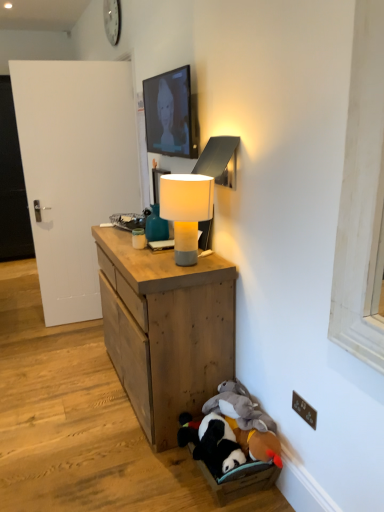
Question: Is the position of white matte door at left, which ranks as the 2th door in front-to-back order, more distant than that of white matte lamp at center?

Choices:
 (A) no
 (B) yes

Answer: (B)

Question: Considering the relative sizes of white matte door at left, which ranks as the 2th door in front-to-back order, and white matte lamp at center in the image provided, is white matte door at left, which ranks as the 2th door in front-to-back order, thinner than white matte lamp at center?

Choices:
 (A) yes
 (B) no

Answer: (B)

Question: Does white matte door at left, which ranks as the 2th door in front-to-back order, have a lesser height compared to white matte lamp at center?

Choices:
 (A) yes
 (B) no

Answer: (B)

Question: Is white matte door at left, positioned as the 1th door in left-to-right order, at the right side of white matte lamp at center?

Choices:
 (A) yes
 (B) no

Answer: (B)

Question: From a real-world perspective, is white matte door at left, which ranks as the 2th door in front-to-back order, under white matte lamp at center?

Choices:
 (A) yes
 (B) no

Answer: (A)

Question: Considering the relative sizes of white matte door at left, acting as the 2th door starting from the right, and white matte lamp at center in the image provided, is white matte door at left, acting as the 2th door starting from the right, bigger than white matte lamp at center?

Choices:
 (A) no
 (B) yes

Answer: (B)

Question: Does soft plush toys at lower right have a lesser width compared to white matte door at left, the second door in the left-to-right sequence?

Choices:
 (A) yes
 (B) no

Answer: (B)

Question: Considering the relative positions of soft plush toys at lower right and white matte door at left, the 1th door when ordered from front to back, in the image provided, is soft plush toys at lower right to the left of white matte door at left, the 1th door when ordered from front to back, from the viewer's perspective?

Choices:
 (A) yes
 (B) no

Answer: (B)

Question: Is soft plush toys at lower right aimed at white matte door at left, the second door in the back-to-front sequence?

Choices:
 (A) yes
 (B) no

Answer: (B)

Question: From a real-world perspective, is soft plush toys at lower right located beneath white matte door at left, the second door in the back-to-front sequence?

Choices:
 (A) no
 (B) yes

Answer: (B)

Question: Can you confirm if soft plush toys at lower right is taller than white matte door at left, the 1th door when ordered from front to back?

Choices:
 (A) yes
 (B) no

Answer: (B)

Question: Does soft plush toys at lower right have a smaller size compared to white matte door at left, the 1th door from the right?

Choices:
 (A) no
 (B) yes

Answer: (B)

Question: Could brown plastic electric outlet at lower right be considered to be inside matte black tv at upper center?

Choices:
 (A) yes
 (B) no

Answer: (B)